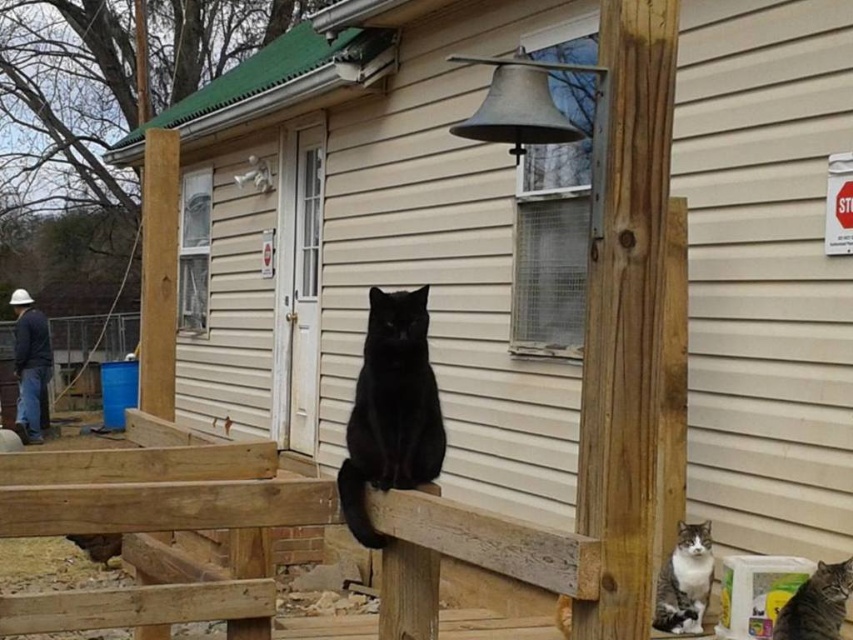
You are a construction worker who needs to place a 1.2 meter long plank between the gray tabby cat at lower right and the tabby fur cat at lower right. Based on their sizes, will the plank fit between them without touching either cat?

The gray tabby cat at lower right is bigger than the tabby fur cat at lower right, but the size difference does not provide information about the distance between them. The plank may or may not fit depending on their actual spacing, which is not specified.